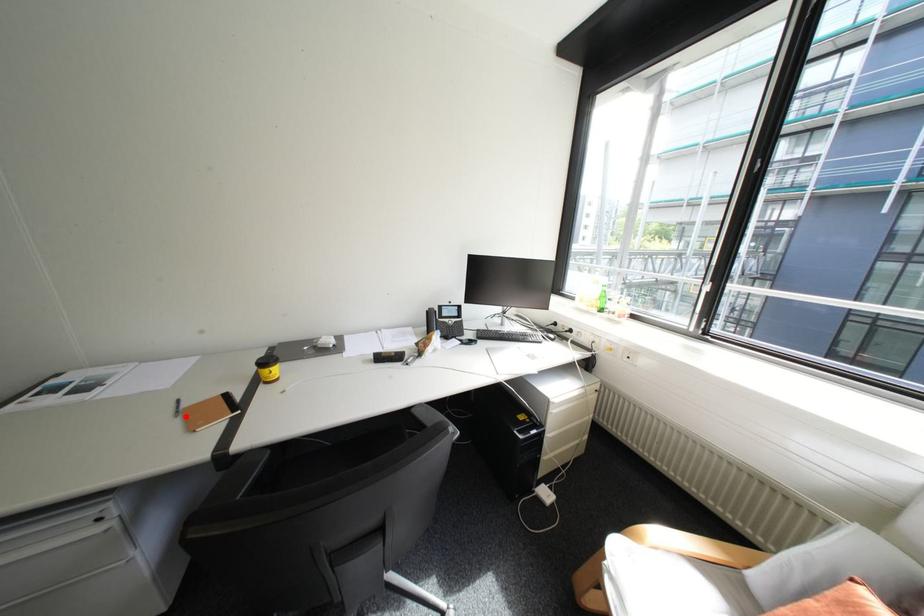
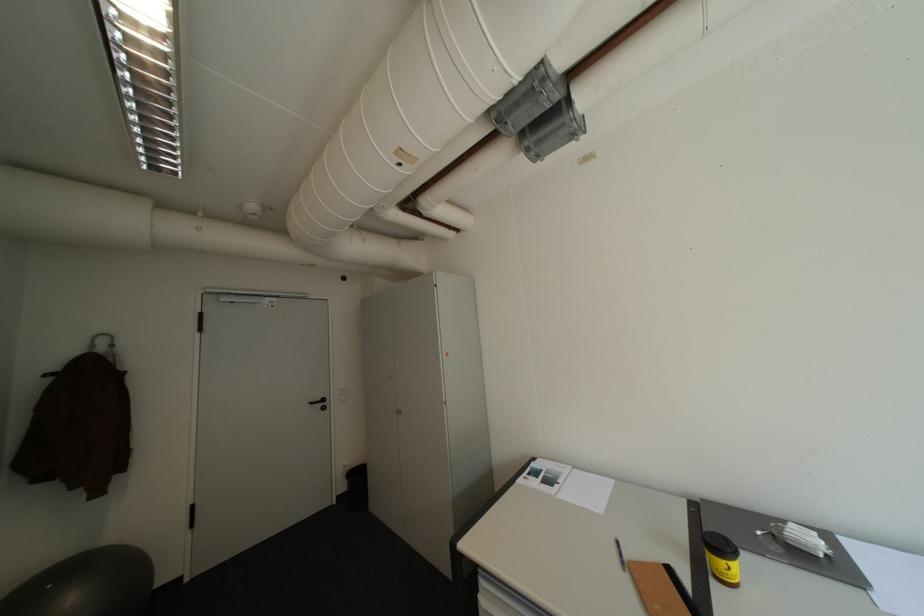
The point at the highlighted location is marked in the first image. Where is the corresponding point in the second image?

(634, 570)